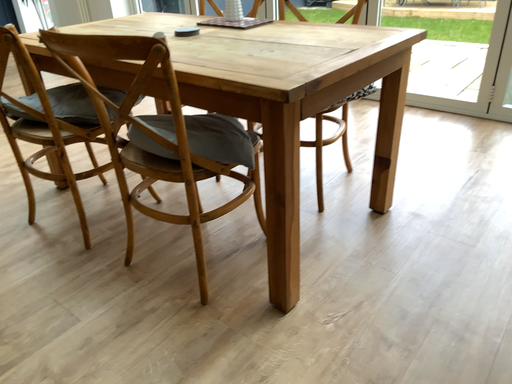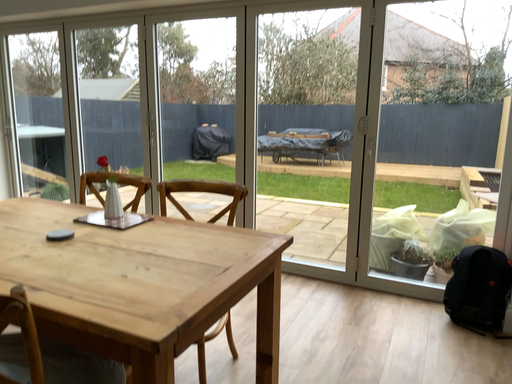
Question: Which way did the camera rotate in the video?

Choices:
 (A) rotated right
 (B) rotated left

Answer: (A)